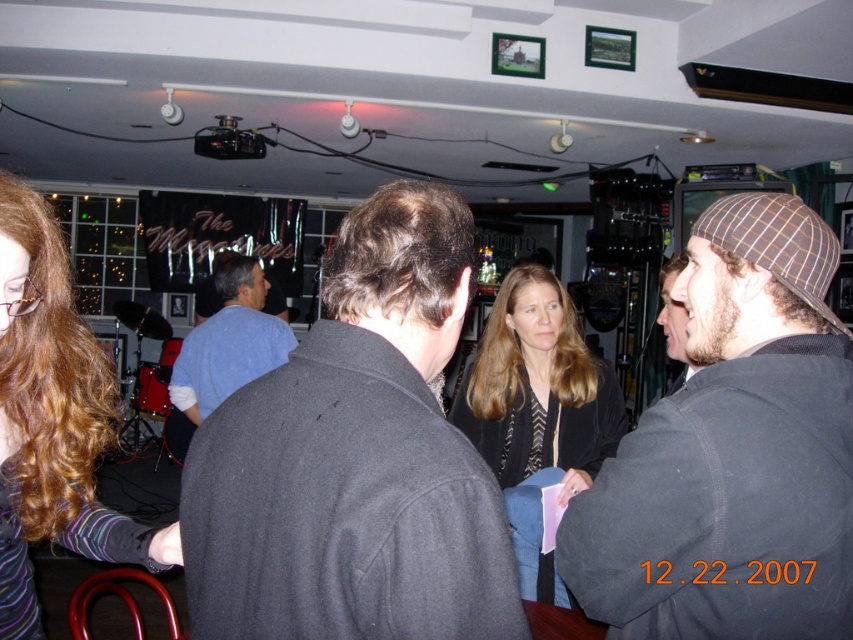
Question: Which point is closer to the camera?

Choices:
 (A) (73, 380)
 (B) (579, 481)
 (C) (795, 337)

Answer: (C)

Question: Is dark gray wool coat at center smaller than shiny brown hair at lower left?

Choices:
 (A) yes
 (B) no

Answer: (A)

Question: Which object is farther from the camera taking this photo?

Choices:
 (A) dark gray knit hat at right
 (B) shiny brown hair at lower left
 (C) blue cotton shirt at center

Answer: (C)

Question: Is the position of shiny brown hair at lower left less distant than that of matte black jacket at center?

Choices:
 (A) no
 (B) yes

Answer: (B)

Question: Which object is positioned farthest from the blue cotton shirt at center?

Choices:
 (A) matte black jacket at center
 (B) shiny brown hair at lower left
 (C) dark gray wool coat at center
 (D) dark gray knit hat at right

Answer: (C)

Question: Can you confirm if dark gray wool coat at center is positioned to the left of blue cotton shirt at center?

Choices:
 (A) no
 (B) yes

Answer: (A)